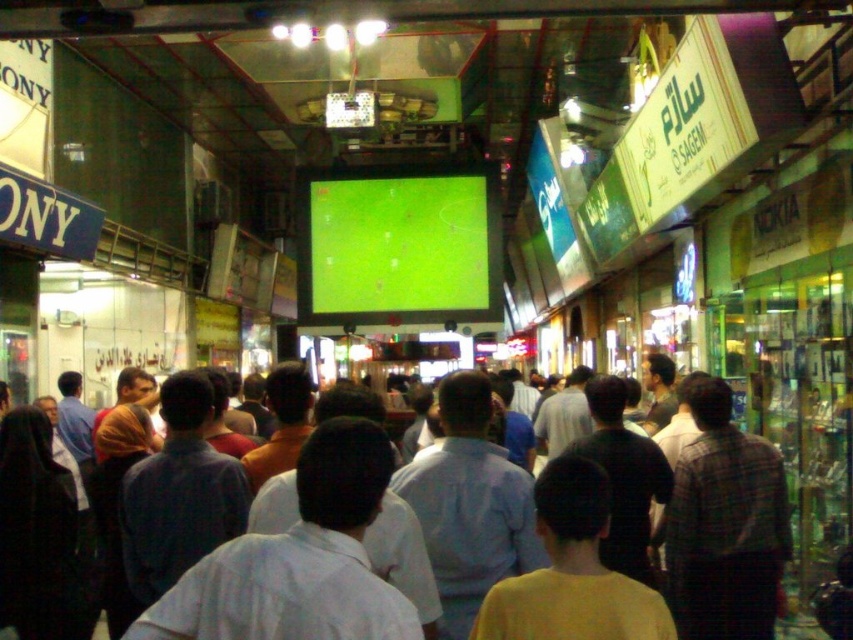
You are standing in a crowded marketplace and want to take a photo of the large green screen showing a soccer match. The camera you are using has a maximum focus range of 10 meters. Is the point at coordinates point (401, 278) within the camera focus range?

The distance between point (401, 278) and the camera is 10.79 meters, which exceeds the camera maximum focus range of 10 meters. Therefore, the camera cannot focus on the point (401, 278).

You are a photographer standing at the back of the marketplace. You want to take a photo of the light blue shirt at center without the green matte screen at center blocking it. How can you adjust your position to achieve this?

The green matte screen at center is above the light blue shirt at center. To avoid the screen blocking the shirt, you should lower your camera angle or move to a lower position so that the shirt is visible below the screen.